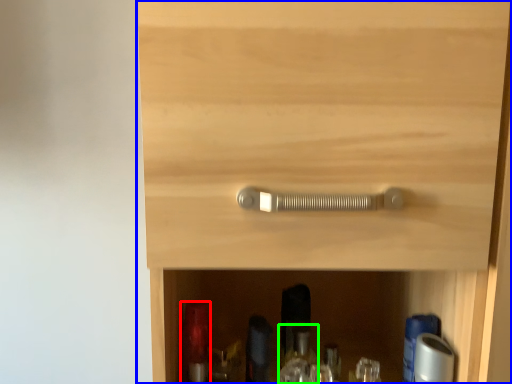
Question: Estimate the real-world distances between objects in this image. Which object is closer to bottle (highlighted by a red box), cupboard (highlighted by a blue box) or bottle (highlighted by a green box)?

Choices:
 (A) cupboard
 (B) bottle

Answer: (B)